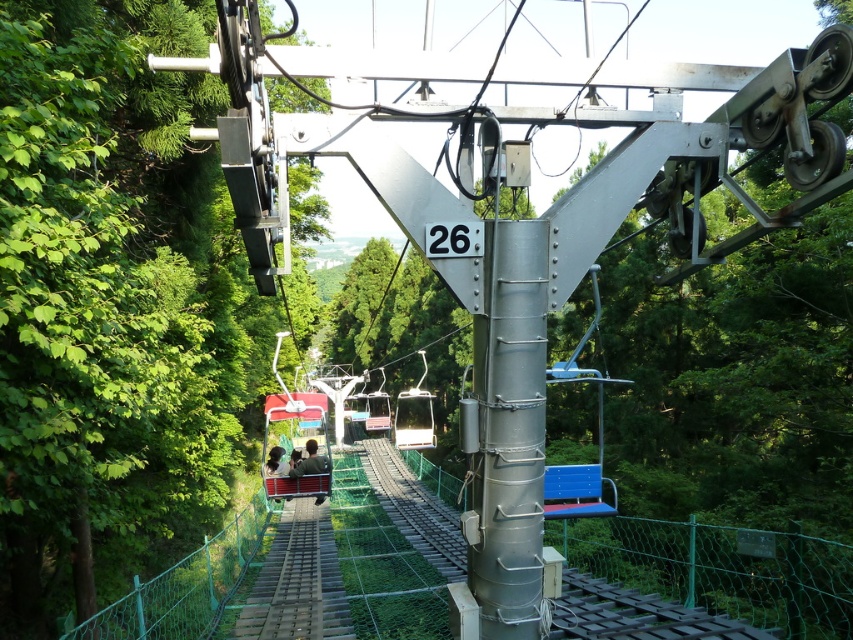
Does metallic gray pole at center lie behind metallic silver ski lift at center?

No, it is in front of metallic silver ski lift at center.

Find the location of a particular element. The height and width of the screenshot is (640, 853). metallic gray pole at center is located at coordinates (509, 429).

Where is `metallic gray pole at center`? The height and width of the screenshot is (640, 853). metallic gray pole at center is located at coordinates (509, 429).

Who is positioned more to the right, metallic silver ski lift at center or matte black jacket at center?

Positioned to the right is metallic silver ski lift at center.

Where is `metallic silver ski lift at center`? metallic silver ski lift at center is located at coordinates (415, 416).

The height and width of the screenshot is (640, 853). Find the location of `metallic silver ski lift at center`. metallic silver ski lift at center is located at coordinates coord(415,416).

Who is more distant from viewer, (469, 554) or (323, 458)?

The point (323, 458) is more distant.

Is point (492, 260) farther from viewer compared to point (306, 442)?

No, (492, 260) is in front of (306, 442).

Where is `metallic gray pole at center`? The width and height of the screenshot is (853, 640). metallic gray pole at center is located at coordinates (509, 429).